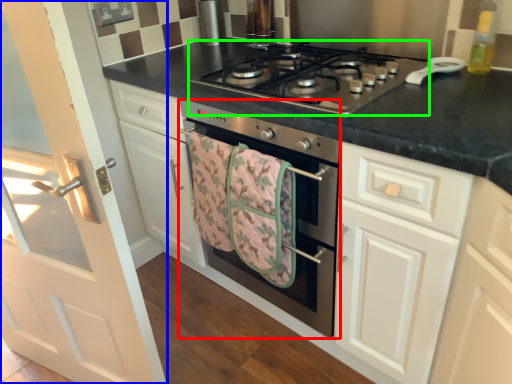
Question: Which object is the farthest from oven (highlighted by a red box)? Choose among these: door (highlighted by a blue box) or gas stove (highlighted by a green box).

Choices:
 (A) door
 (B) gas stove

Answer: (A)